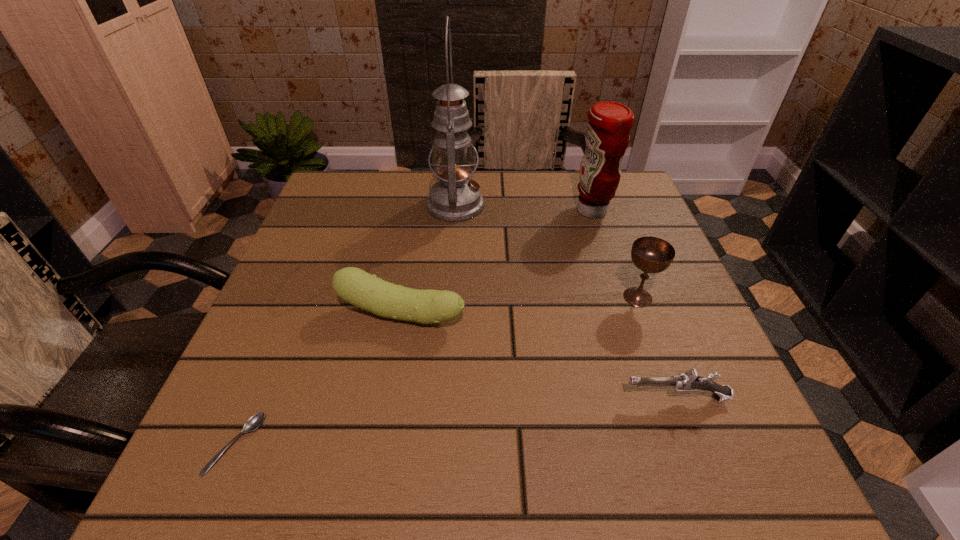
This screenshot has height=540, width=960. In order to click on vacant space that is in between the soupspoon and the condiment in this screenshot , I will do `click(414, 327)`.

Locate an element on the screen. The width and height of the screenshot is (960, 540). blank region between the tallest object and the second nearest object is located at coordinates (565, 301).

You are a GUI agent. You are given a task and a screenshot of the screen. Output one action in this format:
    pyautogui.click(x=<x>, y=<y>)
    Task: Click on the object that is the fifth closest to the fifth shortest object
    The height and width of the screenshot is (540, 960).
    Given the screenshot: What is the action you would take?
    pyautogui.click(x=255, y=421)

Point out which object is positioned as the second nearest to the second tallest object. Please provide its 2D coordinates. Your answer should be formatted as a tuple, i.e. [(x, y)], where the tuple contains the x and y coordinates of a point satisfying the conditions above.

[(455, 198)]

You are a GUI agent. You are given a task and a screenshot of the screen. Output one action in this format:
    pyautogui.click(x=<x>, y=<y>)
    Task: Click on the vacant region that satisfies the following two spatial constraints: 1. aimed along the barrel of the fifth tallest object; 2. on the front side of the shortest object
    The image size is (960, 540).
    Given the screenshot: What is the action you would take?
    pyautogui.click(x=693, y=444)